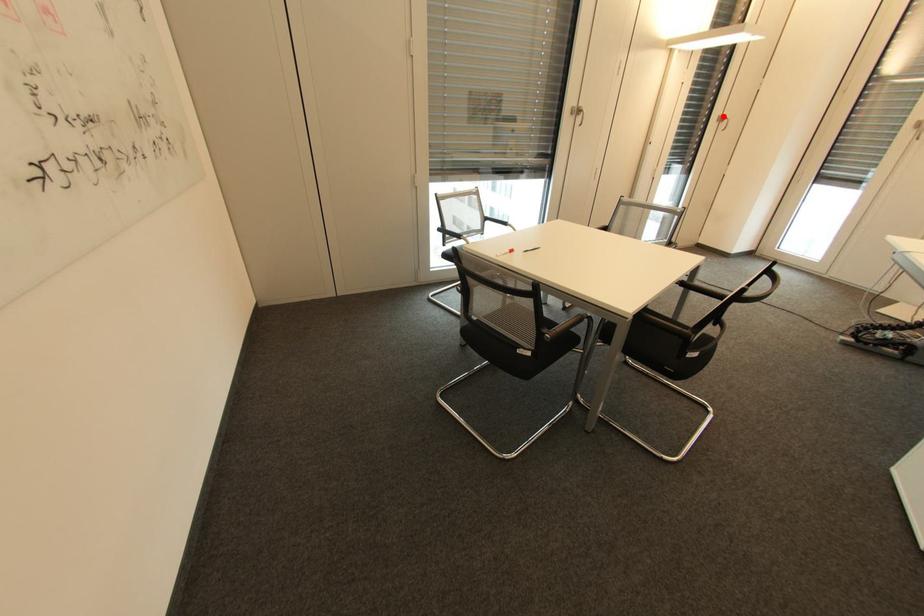
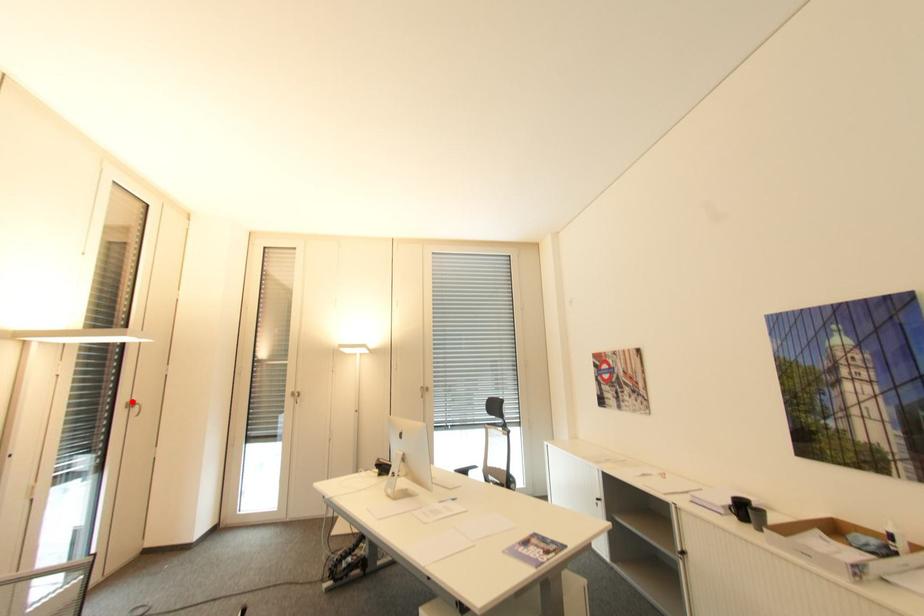
I am providing you with two images of the same scene from different viewpoints. A red point is marked on the first image and another point is marked on the second image. Are the points marked in image1 and image2 representing the same 3D position?

Yes